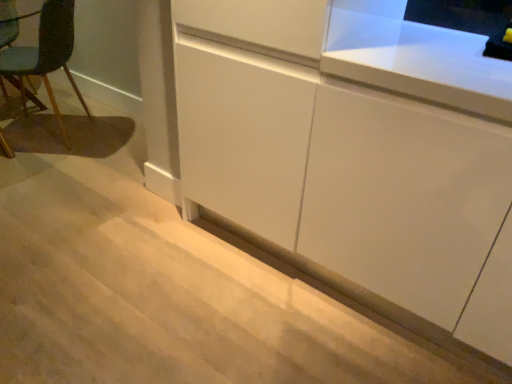
The height and width of the screenshot is (384, 512). Describe the element at coordinates (46, 55) in the screenshot. I see `teal fabric chair at left` at that location.

How much space does white matte cabinet at center, positioned as the 1th cabinetry in right-to-left order, occupy vertically?

The height of white matte cabinet at center, positioned as the 1th cabinetry in right-to-left order, is 36.99 inches.

Measure the distance between point [308,36] and camera.

The distance of point [308,36] from camera is 4.12 feet.

The width and height of the screenshot is (512, 384). What are the coordinates of `teal fabric chair at left` in the screenshot? It's located at (46, 55).

Which object is closer to the camera, white matte cabinet at center, positioned as the 1th cabinetry in right-to-left order, or white matte cabinet at lower center, which is counted as the first cabinetry, starting from the left?

white matte cabinet at lower center, which is counted as the first cabinetry, starting from the left, is in front.

How different are the orientations of white matte cabinet at center, positioned as the 1th cabinetry in right-to-left order, and white matte cabinet at lower center, which is counted as the first cabinetry, starting from the left, in degrees?

0.405 degrees.

Which object is thinner, white matte cabinet at center, positioned as the 1th cabinetry in right-to-left order, or white matte cabinet at lower center, the second cabinetry from the right?

white matte cabinet at center, positioned as the 1th cabinetry in right-to-left order, is thinner.

Considering the positions of points (371, 262) and (361, 100), is point (371, 262) closer to camera compared to point (361, 100)?

No, it is not.

Is white matte cabinet at lower center, the second cabinetry from the right, touching white matte cabinet at center, positioned as the 1th cabinetry in right-to-left order?

They are not placed beside each other.

Is white matte cabinet at lower center, the second cabinetry from the right, spatially inside white matte cabinet at center, which is counted as the 2th cabinetry, starting from the left, or outside of it?

white matte cabinet at lower center, the second cabinetry from the right, is spatially situated outside white matte cabinet at center, which is counted as the 2th cabinetry, starting from the left.

In the image, is white matte cabinet at lower center, which is counted as the first cabinetry, starting from the left, on the left side or the right side of white matte cabinet at center, positioned as the 1th cabinetry in right-to-left order?

From the image, it's evident that white matte cabinet at lower center, which is counted as the first cabinetry, starting from the left, is to the left of white matte cabinet at center, positioned as the 1th cabinetry in right-to-left order.

Consider the image. Which object is positioned more to the right, teal fabric chair at left or white matte cabinet at lower center, which is counted as the first cabinetry, starting from the left?

white matte cabinet at lower center, which is counted as the first cabinetry, starting from the left.

Does point (45, 55) appear closer or farther from the camera than point (348, 169)?

Clearly, point (45, 55) is more distant from the camera than point (348, 169).

Is teal fabric chair at left spatially inside white matte cabinet at lower center, which is counted as the first cabinetry, starting from the left, or outside of it?

teal fabric chair at left is outside white matte cabinet at lower center, which is counted as the first cabinetry, starting from the left.

Who is bigger, teal fabric chair at left or white matte cabinet at lower center, the second cabinetry from the right?

Bigger between the two is white matte cabinet at lower center, the second cabinetry from the right.

Considering the sizes of white matte cabinet at center, positioned as the 1th cabinetry in right-to-left order, and teal fabric chair at left in the image, is white matte cabinet at center, positioned as the 1th cabinetry in right-to-left order, wider or thinner than teal fabric chair at left?

Considering their sizes, white matte cabinet at center, positioned as the 1th cabinetry in right-to-left order, looks broader than teal fabric chair at left.

Based on their positions, is white matte cabinet at center, positioned as the 1th cabinetry in right-to-left order, located to the left or right of teal fabric chair at left?

white matte cabinet at center, positioned as the 1th cabinetry in right-to-left order, is positioned on teal fabric chair at left's right side.

Considering the sizes of white matte cabinet at center, positioned as the 1th cabinetry in right-to-left order, and teal fabric chair at left in the image, is white matte cabinet at center, positioned as the 1th cabinetry in right-to-left order, taller or shorter than teal fabric chair at left?

white matte cabinet at center, positioned as the 1th cabinetry in right-to-left order, is taller than teal fabric chair at left.

From their relative heights in the image, would you say white matte cabinet at lower center, the second cabinetry from the right, is taller or shorter than teal fabric chair at left?

white matte cabinet at lower center, the second cabinetry from the right, is shorter than teal fabric chair at left.

From a real-world perspective, is white matte cabinet at lower center, which is counted as the first cabinetry, starting from the left, physically above teal fabric chair at left?

Incorrect, from a real-world perspective, white matte cabinet at lower center, which is counted as the first cabinetry, starting from the left, is lower than teal fabric chair at left.

Is white matte cabinet at lower center, the second cabinetry from the right, at the left side of teal fabric chair at left?

No.

Does point (422, 220) appear closer or farther from the camera than point (62, 27)?

Clearly, point (422, 220) is closer to the camera than point (62, 27).

Between teal fabric chair at left and white matte cabinet at center, which is counted as the 2th cabinetry, starting from the left, which one has smaller size?

teal fabric chair at left is smaller.

From a real-world perspective, is teal fabric chair at left positioned under white matte cabinet at center, which is counted as the 2th cabinetry, starting from the left, based on gravity?

Yes.

From the image's perspective, does teal fabric chair at left appear lower than white matte cabinet at center, positioned as the 1th cabinetry in right-to-left order?

No, from the image's perspective, teal fabric chair at left is not below white matte cabinet at center, positioned as the 1th cabinetry in right-to-left order.

Based on the photo, in terms of width, does teal fabric chair at left look wider or thinner when compared to white matte cabinet at center, positioned as the 1th cabinetry in right-to-left order?

Considering their sizes, teal fabric chair at left looks slimmer than white matte cabinet at center, positioned as the 1th cabinetry in right-to-left order.

This screenshot has width=512, height=384. What are the coordinates of `cabinetry on the right of white matte cabinet at lower center, which is counted as the first cabinetry, starting from the left` in the screenshot? It's located at (403, 197).

The width and height of the screenshot is (512, 384). I want to click on cabinetry lying behind the white matte cabinet at lower center, the second cabinetry from the right, so click(403, 197).

From the image, which object appears to be nearer to white matte cabinet at center, positioned as the 1th cabinetry in right-to-left order, white matte cabinet at lower center, which is counted as the first cabinetry, starting from the left, or teal fabric chair at left?

white matte cabinet at lower center, which is counted as the first cabinetry, starting from the left.

Based on their spatial positions, is white matte cabinet at lower center, which is counted as the first cabinetry, starting from the left, or white matte cabinet at center, which is counted as the 2th cabinetry, starting from the left, further from teal fabric chair at left?

white matte cabinet at center, which is counted as the 2th cabinetry, starting from the left, is further to teal fabric chair at left.

Looking at this image, based on their spatial positions, is teal fabric chair at left or white matte cabinet at lower center, which is counted as the first cabinetry, starting from the left, further from white matte cabinet at center, positioned as the 1th cabinetry in right-to-left order?

teal fabric chair at left is further to white matte cabinet at center, positioned as the 1th cabinetry in right-to-left order.

Looking at this image, which object lies nearer to the anchor point white matte cabinet at lower center, which is counted as the first cabinetry, starting from the left, teal fabric chair at left or white matte cabinet at center, which is counted as the 2th cabinetry, starting from the left?

white matte cabinet at center, which is counted as the 2th cabinetry, starting from the left.

Estimate the real-world distances between objects in this image. Which object is closer to white matte cabinet at lower center, the second cabinetry from the right, white matte cabinet at center, positioned as the 1th cabinetry in right-to-left order, or teal fabric chair at left?

Among the two, white matte cabinet at center, positioned as the 1th cabinetry in right-to-left order, is located nearer to white matte cabinet at lower center, the second cabinetry from the right.

When comparing their distances from teal fabric chair at left, does white matte cabinet at center, which is counted as the 2th cabinetry, starting from the left, or white matte cabinet at lower center, which is counted as the first cabinetry, starting from the left, seem further?

white matte cabinet at center, which is counted as the 2th cabinetry, starting from the left, is further to teal fabric chair at left.

Locate an element on the screen. The image size is (512, 384). cabinetry located between teal fabric chair at left and white matte cabinet at center, which is counted as the 2th cabinetry, starting from the left, in the left-right direction is located at coordinates (355, 154).